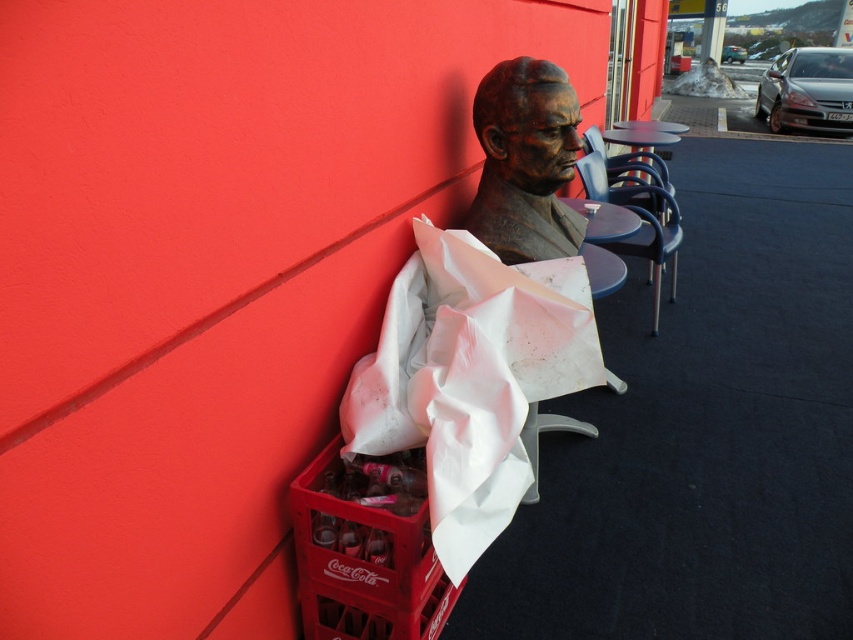
Is red plastic crate at lower left further to camera compared to bronze bust at center?

No, it is in front of bronze bust at center.

Who is more distant from viewer, (x=332, y=500) or (x=549, y=97)?

The point (x=549, y=97) is behind.

Find the location of `red plastic crate at lower left`. red plastic crate at lower left is located at coordinates (363, 564).

Between metallic blue chair at center and metallic blue table at center, which one is positioned lower?

Positioned lower is metallic blue chair at center.

Is metallic blue chair at center closer to the viewer compared to metallic blue table at center?

Yes, metallic blue chair at center is in front of metallic blue table at center.

This screenshot has width=853, height=640. What are the coordinates of `metallic blue chair at center` in the screenshot? It's located at (640, 221).

This screenshot has width=853, height=640. I want to click on metallic blue chair at center, so click(640, 221).

Who is shorter, metallic blue table at center or white plastic table at center?

With less height is white plastic table at center.

Which is more to the left, metallic blue table at center or white plastic table at center?

white plastic table at center

You are a GUI agent. You are given a task and a screenshot of the screen. Output one action in this format:
    pyautogui.click(x=<x>, y=<y>)
    Task: Click on the metallic blue table at center
    The height and width of the screenshot is (640, 853).
    Given the screenshot: What is the action you would take?
    pyautogui.click(x=643, y=140)

This screenshot has height=640, width=853. Find the location of `metallic blue table at center`. metallic blue table at center is located at coordinates (643, 140).